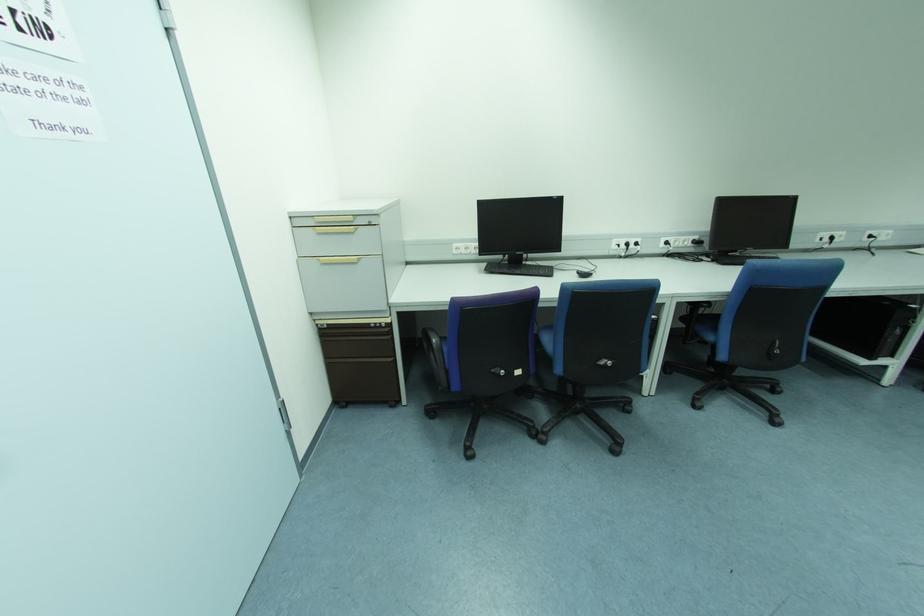
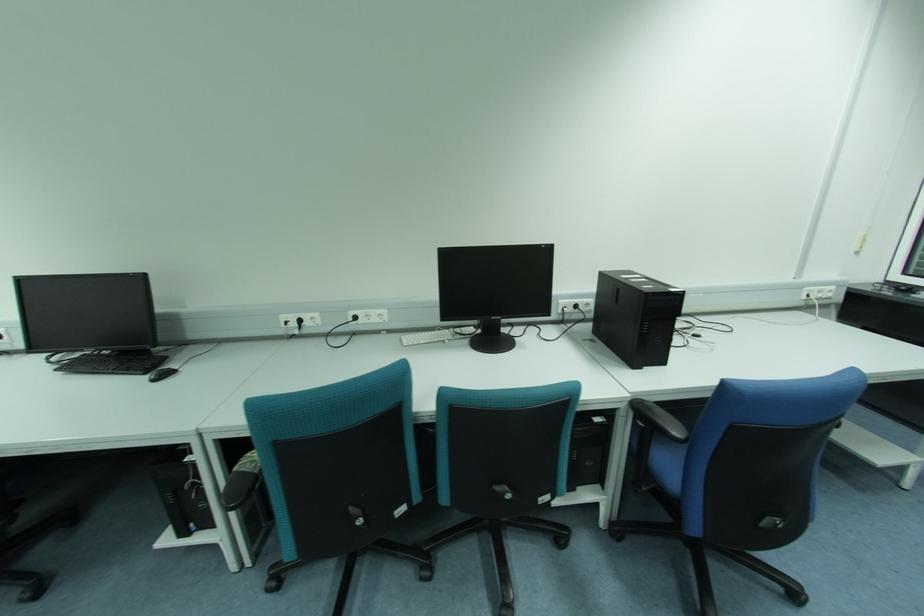
The point at (844, 238) is marked in the first image. Where is the corresponding point in the second image?

(319, 322)